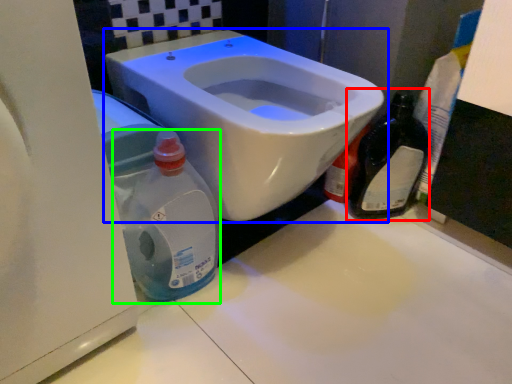
Question: Which is nearer to the bottle (highlighted by a red box)? toilet (highlighted by a blue box) or cleaning product (highlighted by a green box).

Choices:
 (A) toilet
 (B) cleaning product

Answer: (A)